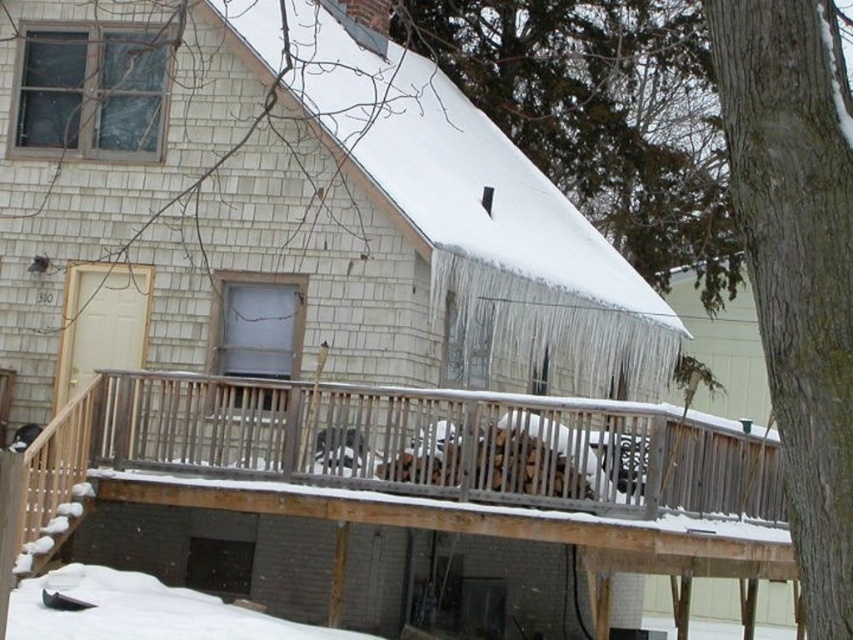
Question: Is wooden deck at center to the left of white fluffy snow at lower left from the viewer's perspective?

Choices:
 (A) no
 (B) yes

Answer: (A)

Question: Estimate the real-world distances between objects in this image. Which object is closer to the wooden deck at center?

Choices:
 (A) smooth gray bark at right
 (B) white fluffy snow at lower left

Answer: (B)

Question: Among these points, which one is nearest to the camera?

Choices:
 (A) (62, 586)
 (B) (730, 129)

Answer: (B)

Question: Which point is closer to the camera?

Choices:
 (A) (757, 310)
 (B) (51, 586)
 (C) (259, 417)

Answer: (A)

Question: Does wooden deck at center appear on the left side of smooth gray bark at right?

Choices:
 (A) no
 (B) yes

Answer: (B)

Question: Can you confirm if wooden deck at center is bigger than white fluffy snow at lower left?

Choices:
 (A) no
 (B) yes

Answer: (A)